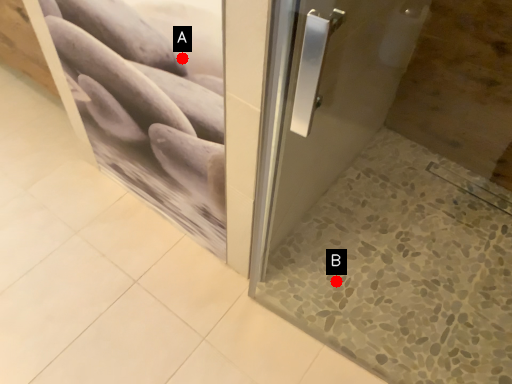
Question: Two points are circled on the image, labeled by A and B beside each circle. Among these points, which one is farthest from the camera?

Choices:
 (A) A is further
 (B) B is further

Answer: (B)